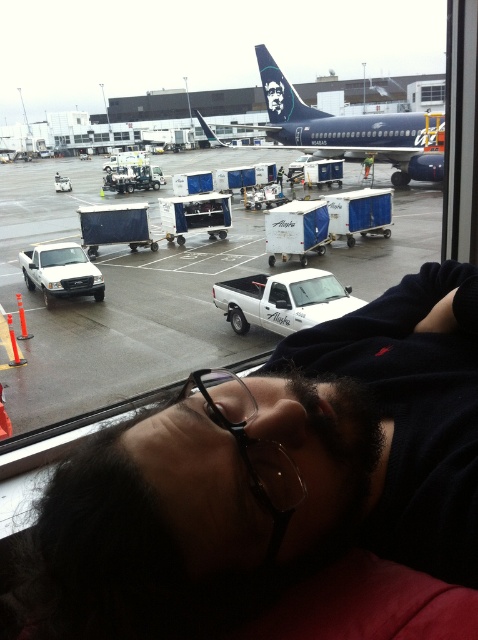
Question: Does blue metallic airplane at center lie in front of transparent glass window at upper center?

Choices:
 (A) no
 (B) yes

Answer: (B)

Question: Which object is closer to the camera taking this photo?

Choices:
 (A) white plastic containers at center
 (B) transparent glass window at upper center
 (C) blue metallic airplane at center

Answer: (A)

Question: Estimate the real-world distances between objects in this image. Which object is farther from the transparent plastic glasses at center?

Choices:
 (A) transparent glass window at upper center
 (B) dark hair at lower center
 (C) white plastic containers at center
 (D) blue metallic airplane at center

Answer: (A)

Question: Which object appears farthest from the camera in this image?

Choices:
 (A) blue metallic airplane at center
 (B) dark hair at lower center
 (C) white plastic containers at center
 (D) transparent plastic glasses at center

Answer: (A)

Question: Can you confirm if white plastic containers at center is wider than transparent plastic glasses at center?

Choices:
 (A) yes
 (B) no

Answer: (A)

Question: Considering the relative positions of dark hair at lower center and transparent plastic glasses at center in the image provided, where is dark hair at lower center located with respect to transparent plastic glasses at center?

Choices:
 (A) below
 (B) above

Answer: (B)